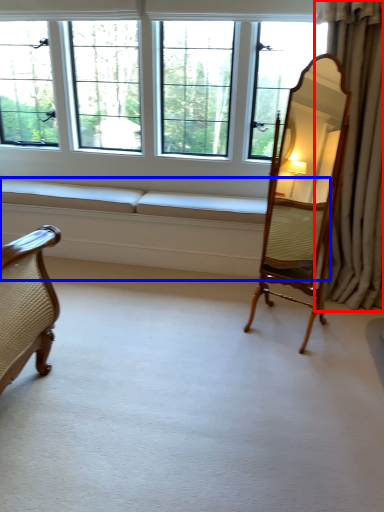
Question: Which object appears closest to the camera in this image, curtain (highlighted by a red box) or couch (highlighted by a blue box)?

Choices:
 (A) curtain
 (B) couch

Answer: (A)